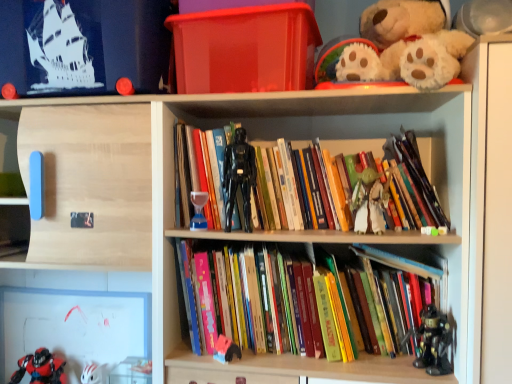
Question: Is green fabric yoda at center, acting as the 2th toy starting from the top, at the left side of hardcover books at center, arranged as the 1th book when ordered from the bottom?

Choices:
 (A) yes
 (B) no

Answer: (B)

Question: Is green fabric yoda at center, the 2th toy from the right, far away from hardcover books at center, the 2th book viewed from the top?

Choices:
 (A) yes
 (B) no

Answer: (B)

Question: Is green fabric yoda at center, which is the sixth toy from left to right, turned away from hardcover books at center, the 2th book viewed from the top?

Choices:
 (A) no
 (B) yes

Answer: (A)

Question: Is hardcover books at center, the 2th book viewed from the top, a part of green fabric yoda at center, the 2th toy from the right?

Choices:
 (A) yes
 (B) no

Answer: (B)

Question: Does green fabric yoda at center, the 2th toy from the right, appear on the right side of hardcover books at center, the 2th book viewed from the top?

Choices:
 (A) yes
 (B) no

Answer: (A)

Question: Is white matte helmet at lower left, which ranks as the 2th toy in bottom-to-top order, in front of or behind translucent glass hourglass at center, placed as the fifth toy when sorted from bottom to top, in the image?

Choices:
 (A) behind
 (B) front

Answer: (A)

Question: Is point (95, 365) positioned closer to the camera than point (201, 192)?

Choices:
 (A) farther
 (B) closer

Answer: (A)

Question: In terms of size, does white matte helmet at lower left, which ranks as the 2th toy in bottom-to-top order, appear bigger or smaller than translucent glass hourglass at center, acting as the third toy starting from the left?

Choices:
 (A) big
 (B) small

Answer: (A)

Question: Is white matte helmet at lower left, the sixth toy when ordered from right to left, taller or shorter than translucent glass hourglass at center, acting as the third toy starting from the left?

Choices:
 (A) short
 (B) tall

Answer: (B)

Question: Is point (100, 370) positioned closer to the camera than point (244, 158)?

Choices:
 (A) closer
 (B) farther

Answer: (B)

Question: Is white matte helmet at lower left, which ranks as the 2th toy in bottom-to-top order, taller or shorter than black plastic action figure at center, placed as the fifth toy when sorted from left to right?

Choices:
 (A) short
 (B) tall

Answer: (A)

Question: Do you think white matte helmet at lower left, the sixth toy when ordered from right to left, is within black plastic action figure at center, positioned as the 3th toy in right-to-left order, or outside of it?

Choices:
 (A) inside
 (B) outside

Answer: (B)

Question: From a real-world perspective, relative to black plastic action figure at center, placed as the fifth toy when sorted from left to right, is white matte helmet at lower left, which ranks as the 2th toy in bottom-to-top order, vertically above or below?

Choices:
 (A) below
 (B) above

Answer: (A)

Question: Is black plastic action figure at center, the 1th toy when ordered from top to bottom, in front of or behind transparent plastic box at upper center in the image?

Choices:
 (A) front
 (B) behind

Answer: (B)

Question: From a real-world perspective, relative to transparent plastic box at upper center, is black plastic action figure at center, the 1th toy when ordered from top to bottom, vertically above or below?

Choices:
 (A) above
 (B) below

Answer: (B)